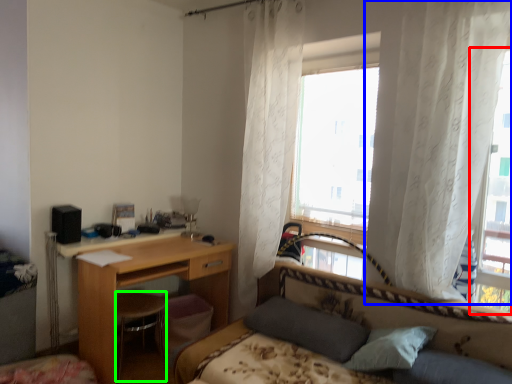
Question: Based on their relative distances, which object is farther from window (highlighted by a red box)? Choose from curtain (highlighted by a blue box) and swivel chair (highlighted by a green box).

Choices:
 (A) curtain
 (B) swivel chair

Answer: (B)